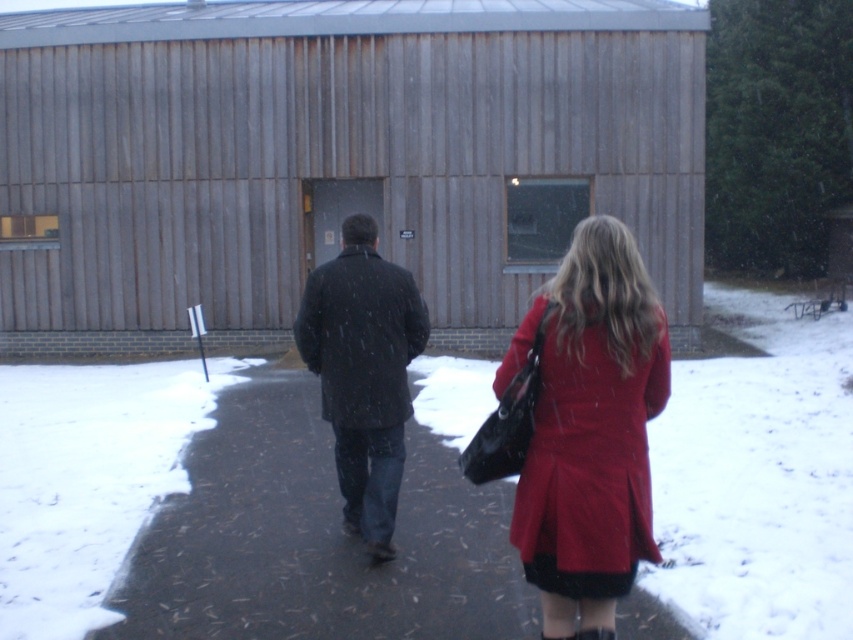
You are a photographer trying to capture the two people walking towards the wooden building. You notice the glossy asphalt at center and the dark matte coat at center in your frame. Which object is closer to the camera?

The glossy asphalt at center is positioned under the dark matte coat at center, meaning the dark matte coat at center is closer to the camera.

You are a delivery robot with a width of 60 centimeters. You need to move from your current position to the wooden building in the scene. There is a glossy asphalt at center and a dark matte coat at center in your path. Can you pass between them without turning sideways?

The distance between the glossy asphalt at center and the dark matte coat at center is 75.68 centimeters. Since the robot is 60 centimeters wide, it can pass through the space between them without needing to turn sideways.